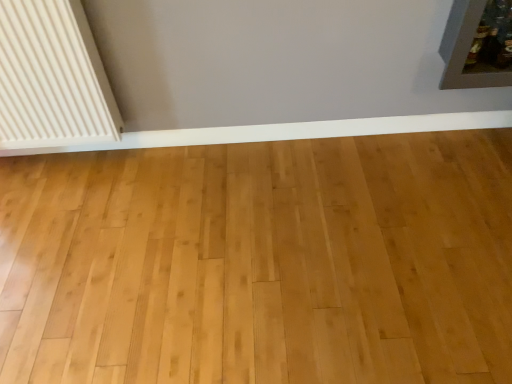
Question: Is white ribbed radiator at left inside white smooth baseboard at lower center?

Choices:
 (A) yes
 (B) no

Answer: (B)

Question: From the image's perspective, is white smooth baseboard at lower center over white ribbed radiator at left?

Choices:
 (A) no
 (B) yes

Answer: (A)

Question: Could you tell me if white smooth baseboard at lower center is facing white ribbed radiator at left?

Choices:
 (A) no
 (B) yes

Answer: (A)

Question: From the image's perspective, is white smooth baseboard at lower center below white ribbed radiator at left?

Choices:
 (A) yes
 (B) no

Answer: (A)

Question: Is the depth of white smooth baseboard at lower center greater than that of white ribbed radiator at left?

Choices:
 (A) no
 (B) yes

Answer: (B)

Question: From a real-world perspective, is white smooth baseboard at lower center located beneath white ribbed radiator at left?

Choices:
 (A) yes
 (B) no

Answer: (A)

Question: Is white ribbed radiator at left located outside white smooth baseboard at lower center?

Choices:
 (A) no
 (B) yes

Answer: (B)

Question: Is white ribbed radiator at left at the left side of white smooth baseboard at lower center?

Choices:
 (A) no
 (B) yes

Answer: (B)

Question: From a real-world perspective, is white ribbed radiator at left under white smooth baseboard at lower center?

Choices:
 (A) yes
 (B) no

Answer: (B)

Question: Is white ribbed radiator at left not close to white smooth baseboard at lower center?

Choices:
 (A) yes
 (B) no

Answer: (B)

Question: Is white smooth baseboard at lower center completely or partially inside white ribbed radiator at left?

Choices:
 (A) no
 (B) yes

Answer: (A)

Question: Is white ribbed radiator at left wider than white smooth baseboard at lower center?

Choices:
 (A) no
 (B) yes

Answer: (B)

Question: Considering the positions of white smooth baseboard at lower center and white ribbed radiator at left in the image, is white smooth baseboard at lower center bigger or smaller than white ribbed radiator at left?

Choices:
 (A) big
 (B) small

Answer: (B)